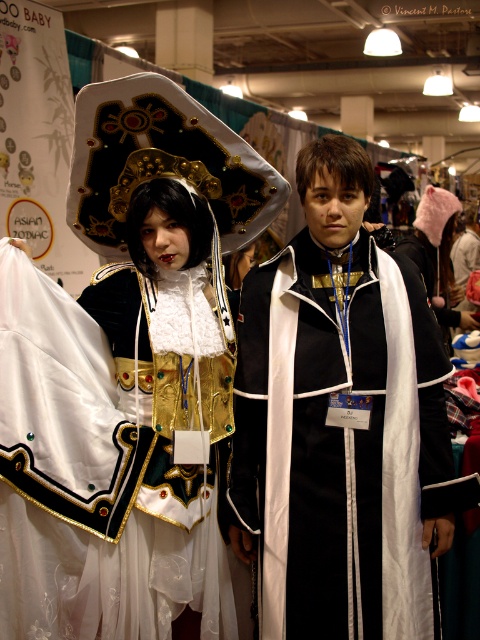
Question: Is shiny gold armor at center positioned behind matte black coat at center?

Choices:
 (A) no
 (B) yes

Answer: (A)

Question: Among these objects, which one is nearest to the camera?

Choices:
 (A) matte black coat at center
 (B) shiny gold armor at center

Answer: (B)

Question: Is shiny gold armor at center in front of matte black coat at center?

Choices:
 (A) no
 (B) yes

Answer: (B)

Question: Can you confirm if shiny gold armor at center is thinner than matte black coat at center?

Choices:
 (A) yes
 (B) no

Answer: (A)

Question: Which point appears farthest from the camera in this image?

Choices:
 (A) (24, 600)
 (B) (322, 460)

Answer: (B)